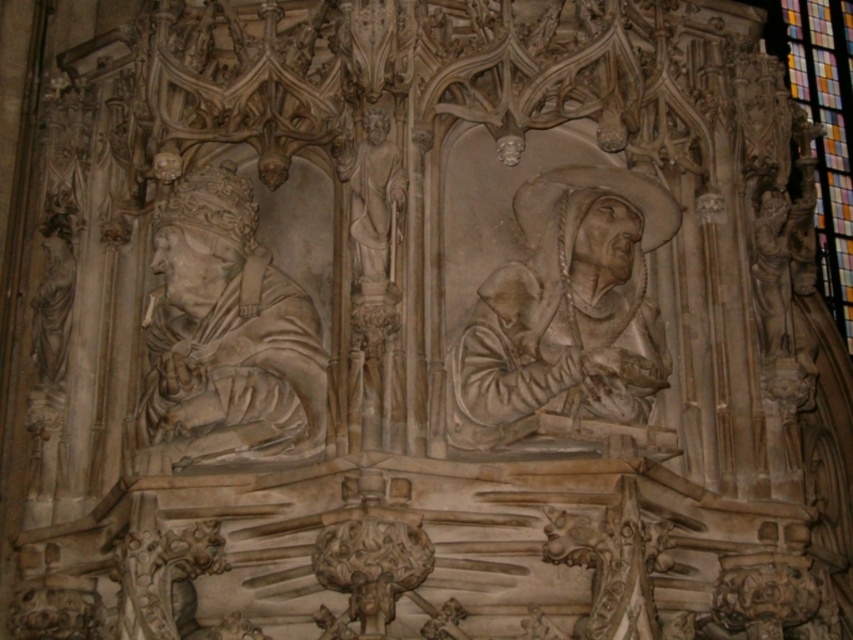
Question: Which of the following is the closest to the observer?

Choices:
 (A) (523, 326)
 (B) (831, 282)
 (C) (263, 385)

Answer: (C)

Question: Which point is farther to the camera?

Choices:
 (A) (373, 188)
 (B) (225, 288)
 (C) (843, 60)

Answer: (C)

Question: Is gray stone statue at center further to the viewer compared to white marble statue at left?

Choices:
 (A) yes
 (B) no

Answer: (B)

Question: Based on their relative distances, which object is farther from the gray stone statue at center?

Choices:
 (A) white marble statue at left
 (B) white marble statue at center
 (C) stained glass at upper right

Answer: (C)

Question: Does gray stone statue at center appear on the right side of white marble statue at center?

Choices:
 (A) no
 (B) yes

Answer: (B)

Question: Is gray stone statue at center positioned behind white marble statue at center?

Choices:
 (A) no
 (B) yes

Answer: (A)